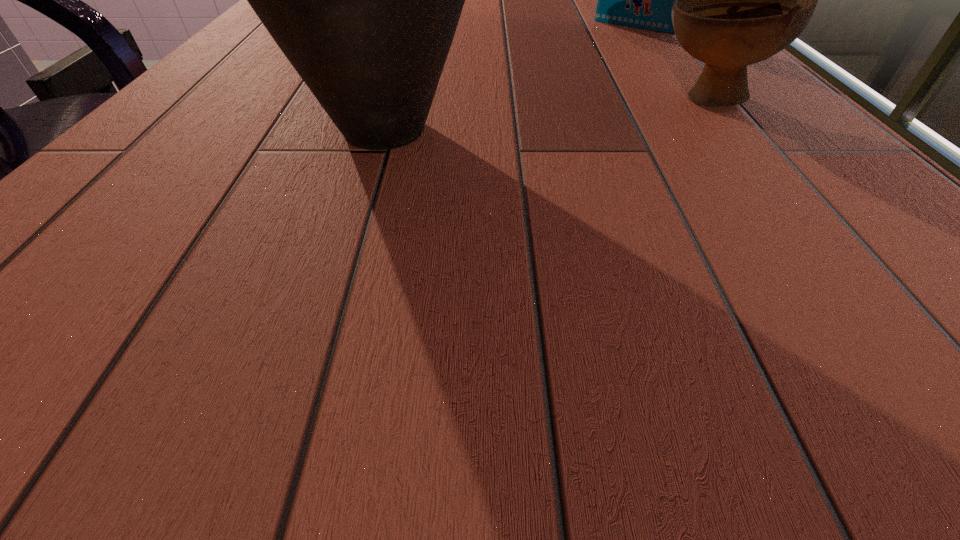
Identify the location of vacant space on the desktop that is between the leftmost object and the shortest object and is positioned on the front cover of the book. This screenshot has height=540, width=960. (537, 116).